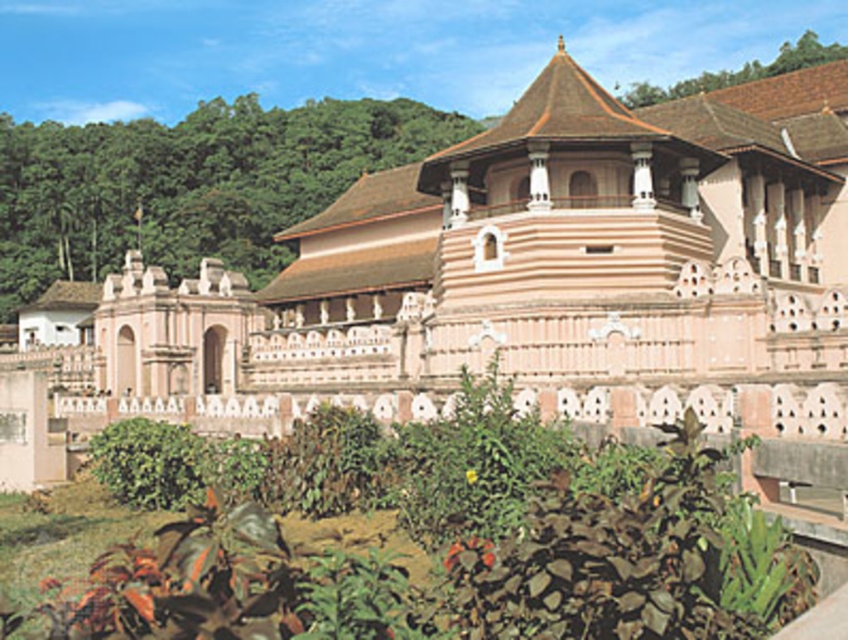
You are a drone operator planning to fly a drone from the pink stone palace at center to the green leafy plants at center. The drone has a maximum flight range of 30 meters. Based on the scene, can the drone make this trip without needing a recharge?

The distance between the pink stone palace at center and the green leafy plants at center is 28.67 meters, which is within the drone s 30 meter range. Therefore, the drone can complete the trip without needing a recharge.

You are an architect visiting a historical site. You observe the pink stone palace at center and the green leafy shrub at left. Which structure has a smaller width?

The pink stone palace at center has a lesser width compared to the green leafy shrub at left, so the pink stone palace at center is narrower.

You are a photographer standing at the camera position. You want to take a closeup shot of the green leafy plants at center. Considering your current position, do you think you can get a clear closeup without moving closer? Please explain your reasoning based on the distance provided.

The distance between you and the green leafy plants at center is 32.39 meters. A typical closeup shot requires the subject to be within a few meters of the camera. At this distance, it would be challenging to capture a clear closeup without moving closer or using specialized equipment like a telephoto lens.